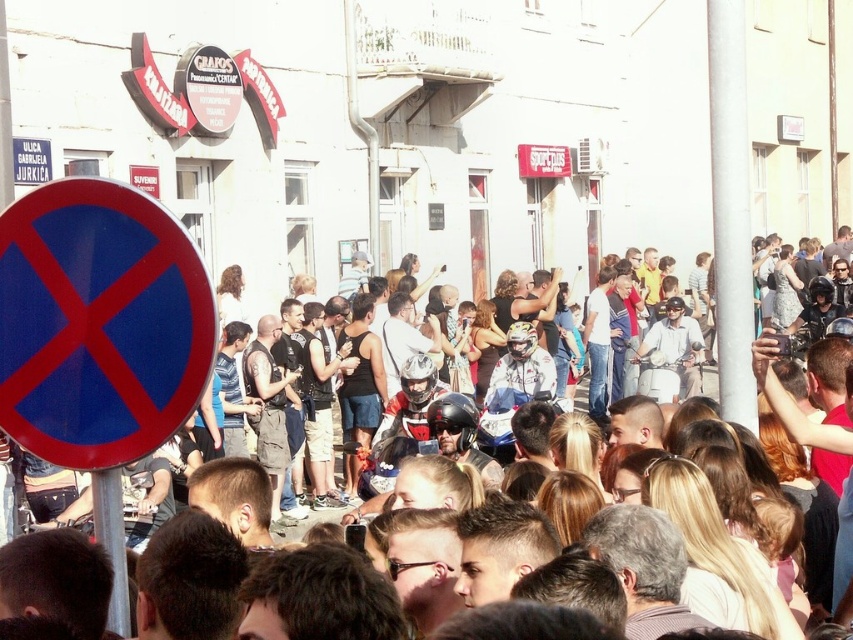
You are standing at the center of the street and see both the blue glossy sign at left and the blue circular sign at left. Which one is closer to you?

The blue glossy sign at left is closer to you because it is only 17.47 meters away from the blue circular sign at left, but without knowing the exact distance from your current position, it is impossible to determine which is closer.

You are a photographer trying to capture the crowd at the event. You notice the silver metallic pole at upper right and the brown hair at center. Which object is positioned more to the left in the image?

The silver metallic pole at upper right is to the left of brown hair at center, so the silver metallic pole at upper right is positioned more to the left in the image.

Based on the photo, you are a delivery person trying to navigate through the street scene. You see both the blue glossy sign at left and the blue circular sign at left. Which of these two signs is narrower?

The blue glossy sign at left is narrower than the blue circular sign at left according to the description.